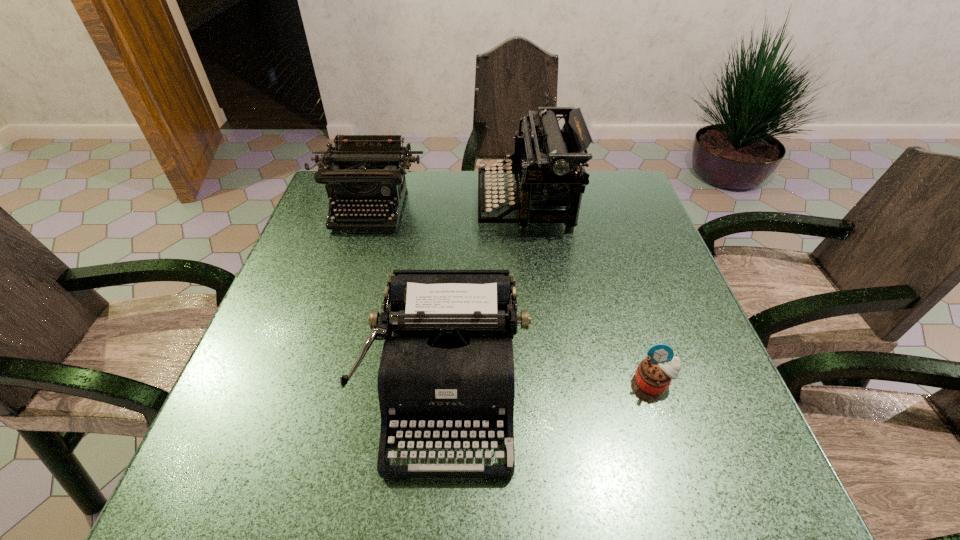
This screenshot has height=540, width=960. I want to click on object situated at the right edge, so click(x=654, y=374).

Locate an element on the screen. Image resolution: width=960 pixels, height=540 pixels. object that is positioned at the far left corner is located at coordinates (360, 170).

Image resolution: width=960 pixels, height=540 pixels. Identify the location of free space at the far edge of the desktop. pos(465,187).

At what (x,y) coordinates should I click in order to perform the action: click on free spot at the left edge of the desktop. Please return your answer as a coordinate pair (x, y). The image size is (960, 540). Looking at the image, I should click on (359, 217).

The image size is (960, 540). I want to click on vacant space at the right edge of the desktop, so click(706, 446).

Identify the location of free space at the far right corner of the desktop. This screenshot has height=540, width=960. (617, 215).

Where is `vacant area at the near right corner of the desktop`? The image size is (960, 540). vacant area at the near right corner of the desktop is located at coordinates (665, 454).

This screenshot has height=540, width=960. Identify the location of unoccupied area between the nearest typewriter and the muffin. (550, 387).

Find the location of `vacant region between the muffin and the nearest typewriter`. vacant region between the muffin and the nearest typewriter is located at coordinates (550, 387).

You are a GUI agent. You are given a task and a screenshot of the screen. Output one action in this format:
    pyautogui.click(x=<x>, y=<y>)
    Task: Click on the free space that is in between the tallest typewriter and the muffin
    This screenshot has width=960, height=540.
    Given the screenshot: What is the action you would take?
    pyautogui.click(x=589, y=293)